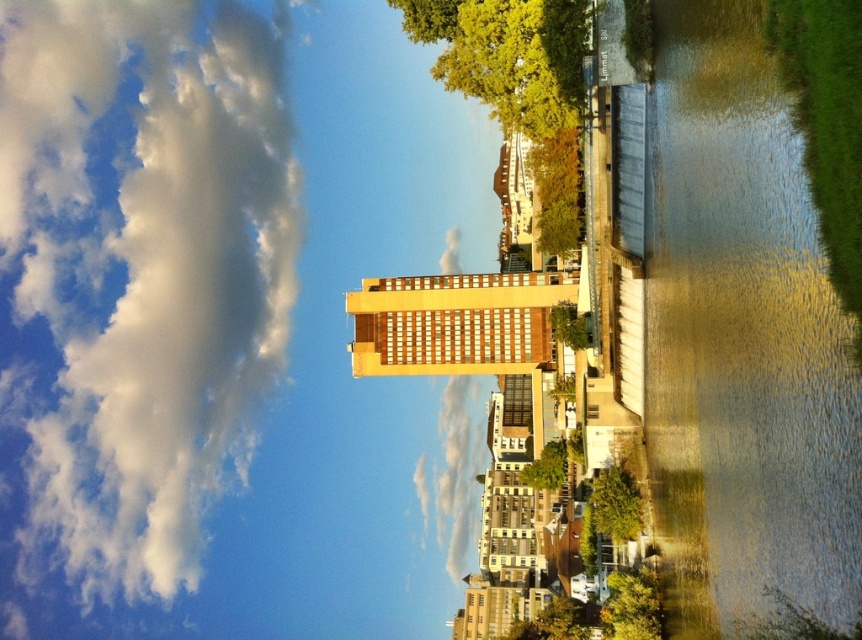
You are standing on the sidewalk in front of the beige building and want to take a photo of both the yellow leafy tree at upper center and the green leafy tree at center. Which tree should you position yourself closer to in order to capture both in the same frame?

You should position yourself closer to the green leafy tree at center because the yellow leafy tree at upper center is to the left of it, allowing both trees to be included in the frame when centered on the green one.